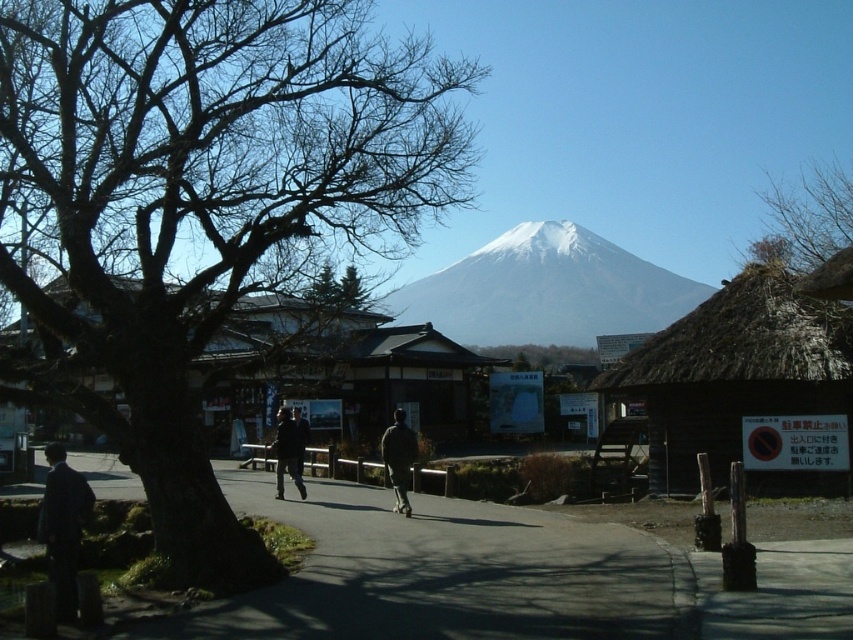
Describe the element at coordinates (746, 384) in the screenshot. I see `thatched wood hut at right` at that location.

Between point (669, 413) and point (554, 250), which one is positioned behind?

The point (554, 250) is behind.

Locate an element on the screen. This screenshot has height=640, width=853. thatched wood hut at right is located at coordinates (746, 384).

The image size is (853, 640). Describe the element at coordinates (746, 384) in the screenshot. I see `thatched wood hut at right` at that location.

Which is below, thatched wood hut at right or dark gray jacket at center?

dark gray jacket at center

The image size is (853, 640). What are the coordinates of `thatched wood hut at right` in the screenshot? It's located at (746, 384).

Find the location of a particular element. thatched wood hut at right is located at coordinates (746, 384).

Does point (466, 260) come farther from viewer compared to point (296, 480)?

That is True.

Where is `white snow-covered mountain at center`? white snow-covered mountain at center is located at coordinates click(x=544, y=291).